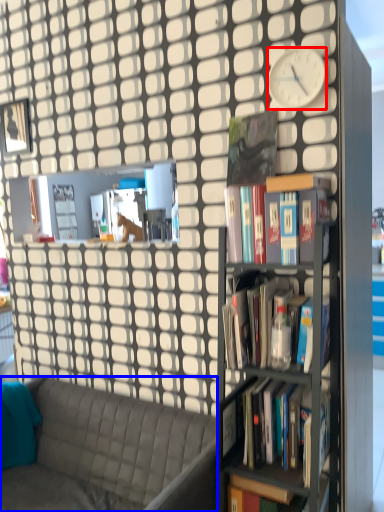
Question: Which of the following is the farthest to the observer, clock (highlighted by a red box) or studio couch (highlighted by a blue box)?

Choices:
 (A) clock
 (B) studio couch

Answer: (A)